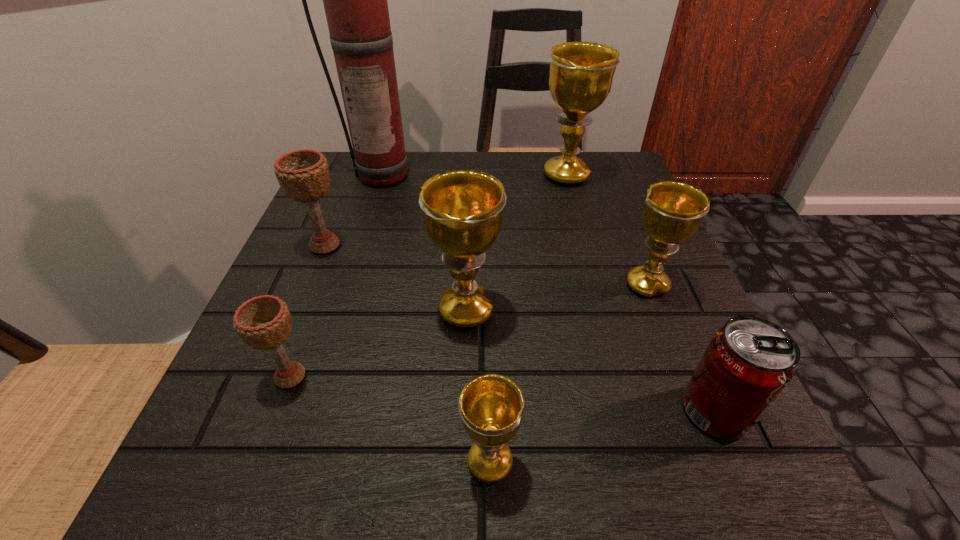
At what (x,y) coordinates should I click in order to perform the action: click on the nearer beige chalice. Please return your answer as a coordinate pair (x, y). Looking at the image, I should click on (264, 322).

Where is `the smaller beige chalice`? The height and width of the screenshot is (540, 960). the smaller beige chalice is located at coordinates (264, 322).

This screenshot has height=540, width=960. Find the location of `the smallest gold chalice`. the smallest gold chalice is located at coordinates (491, 406).

Where is `the nearest chalice`? the nearest chalice is located at coordinates (491, 406).

This screenshot has height=540, width=960. What are the coordinates of `free region located on the side of the red fire extinguisher with the label and nozzle` in the screenshot? It's located at (373, 210).

Locate an element on the screen. The height and width of the screenshot is (540, 960). vacant space positioned on the left of the seventh shortest object is located at coordinates (382, 176).

You are a GUI agent. You are given a task and a screenshot of the screen. Output one action in this format:
    pyautogui.click(x=<x>, y=<y>)
    Task: Click on the blank area located on the left of the sixth shortest object
    The height and width of the screenshot is (540, 960).
    Given the screenshot: What is the action you would take?
    pyautogui.click(x=283, y=310)

Find the location of a particular element. The height and width of the screenshot is (540, 960). vacant space situated on the front of the third biggest gold chalice is located at coordinates (693, 402).

Locate an element on the screen. This screenshot has width=960, height=540. vacant area situated on the back of the sixth nearest object is located at coordinates (350, 181).

Locate an element on the screen. vacant space located on the back of the pop soda is located at coordinates (632, 217).